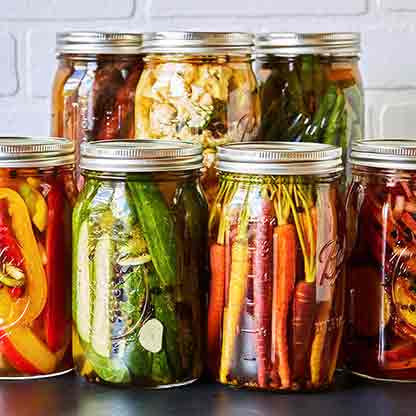
I want to click on white brick wall, so point(382,48).